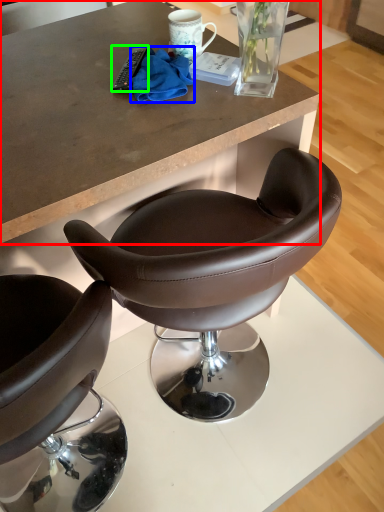
Question: Estimate the real-world distances between objects in this image. Which object is closer to desk (highlighted by a red box), material (highlighted by a blue box) or remote control (highlighted by a green box)?

Choices:
 (A) material
 (B) remote control

Answer: (A)